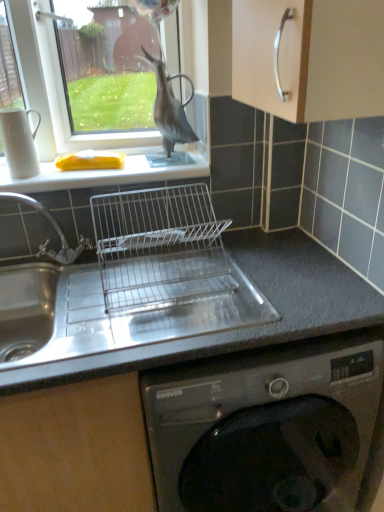
Locate an element on the screen. The image size is (384, 512). free space above white matte sponge at upper left (from a real-world perspective) is located at coordinates (103, 162).